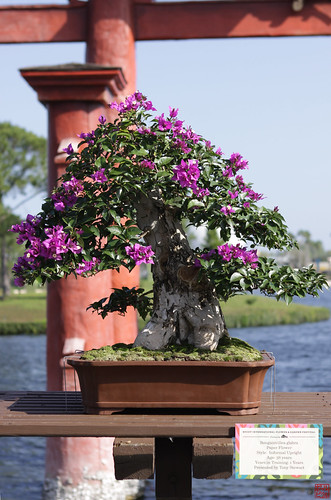
Find the location of `planter`. planter is located at coordinates (103, 380), (233, 394), (265, 364).